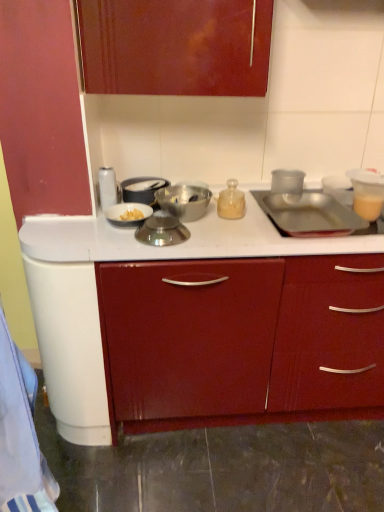
Question: Choose the correct answer: Is white glossy canister at upper left, which is counted as the first kitchen appliance, starting from the left, inside metallic bowl at center, the 3th kitchen appliance viewed from the right, or outside it?

Choices:
 (A) outside
 (B) inside

Answer: (A)

Question: From the image's perspective, relative to metallic bowl at center, the 3th kitchen appliance viewed from the right, is white glossy canister at upper left, which is counted as the first kitchen appliance, starting from the left, above or below?

Choices:
 (A) above
 (B) below

Answer: (A)

Question: Considering the real-world distances, which object is farthest from the shiny metallic bowl at center, which ranks as the 4th kitchen appliance in right-to-left order?

Choices:
 (A) metallic bowl at center, the 3th kitchen appliance viewed from the right
 (B) transparent plastic cup at upper right, which ranks as the 1th kitchen appliance in right-to-left order
 (C) metallic silver sink at right
 (D) translucent plastic cup at upper right
 (E) translucent glass jar at center, the second kitchen appliance positioned from the right

Answer: (D)

Question: Which of these objects is positioned farthest from the shiny metallic bowl at center, which ranks as the 4th kitchen appliance in right-to-left order?

Choices:
 (A) white glossy canister at upper left, which is counted as the first kitchen appliance, starting from the left
 (B) translucent plastic cup at upper right
 (C) white glossy bowl at center left, the 2th kitchen appliance from the left
 (D) metallic bowl at center, which is the fifth kitchen appliance in left-to-right order
 (E) metallic silver sink at right

Answer: (B)